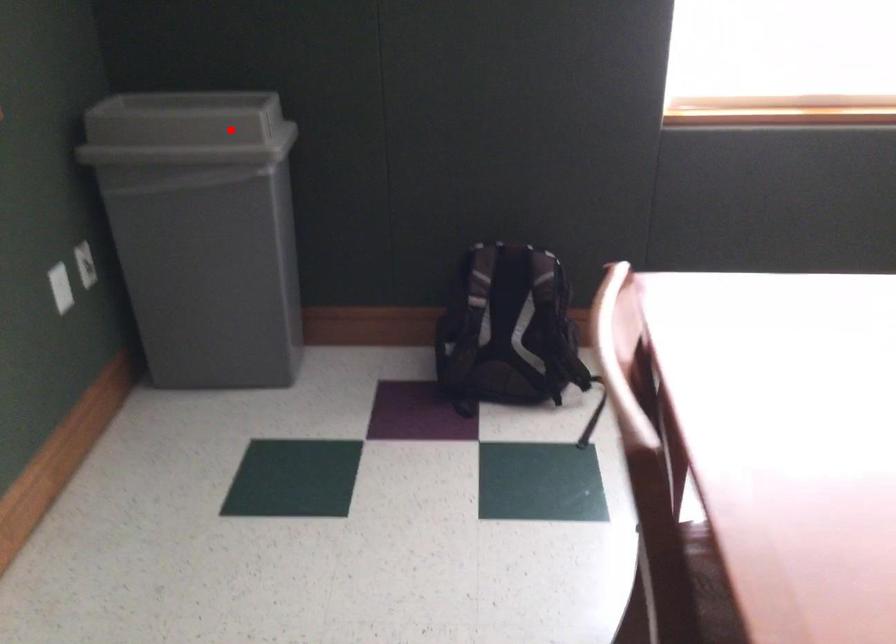
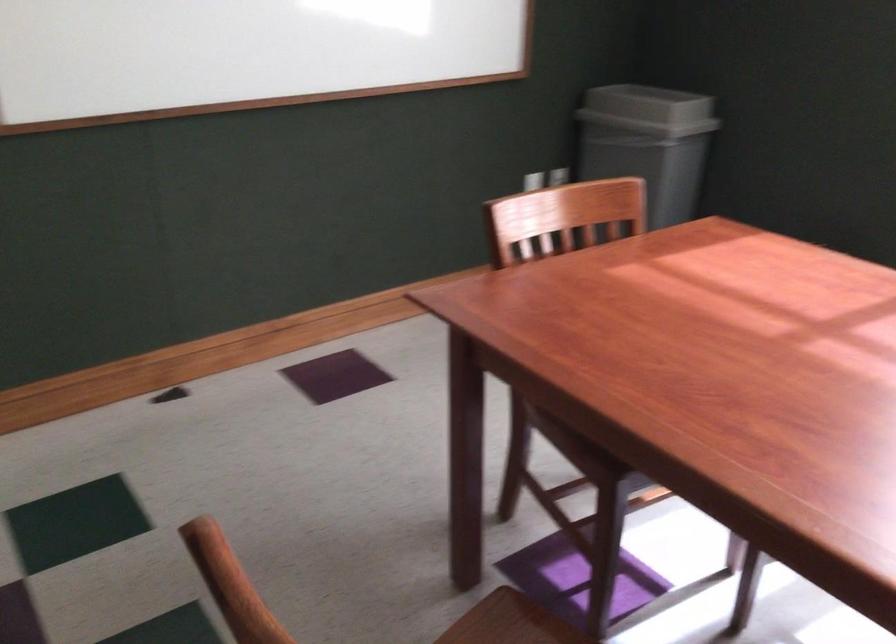
Find the pixel in the second image that matches the highlighted location in the first image.

(648, 109)